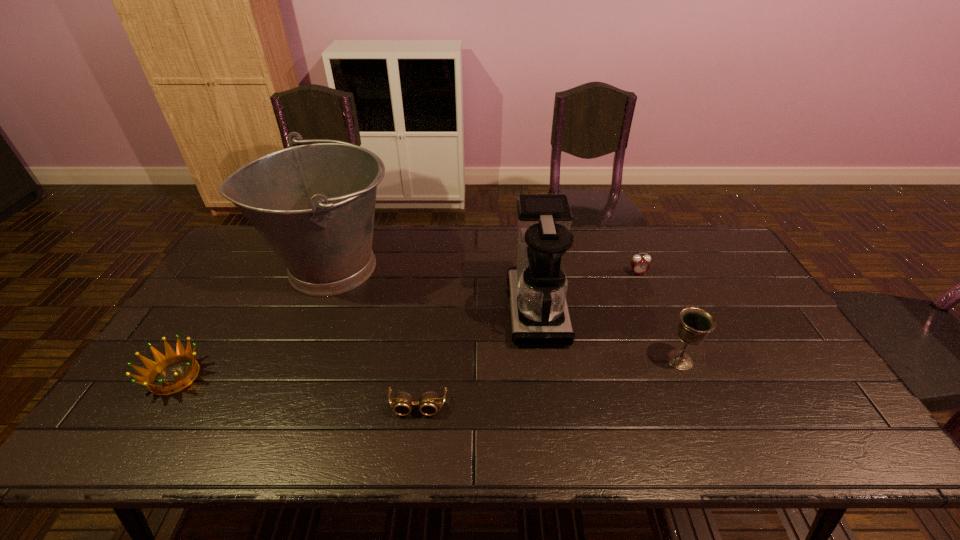
Identify the location of the tallest object. The width and height of the screenshot is (960, 540). (314, 204).

Where is `the second tallest object`? the second tallest object is located at coordinates (537, 287).

Identify the location of coffee maker. This screenshot has width=960, height=540. (537, 287).

Locate an element on the screen. the fourth shortest object is located at coordinates (695, 324).

Find the location of a particular element. The width and height of the screenshot is (960, 540). alarm clock is located at coordinates (640, 264).

I want to click on crown, so click(x=161, y=362).

The image size is (960, 540). Find the location of `goggles`. goggles is located at coordinates (428, 402).

Locate an element on the screen. The image size is (960, 540). the third object from left to right is located at coordinates (428, 402).

You are a GUI agent. You are given a task and a screenshot of the screen. Output one action in this format:
    pyautogui.click(x=<x>, y=<y>)
    Task: Click on the blank area located 0.240m on the front of the tallest object
    
    Given the screenshot: What is the action you would take?
    pyautogui.click(x=287, y=378)

The width and height of the screenshot is (960, 540). I want to click on free region located at the front of the third object from right to left where the controls are located, so click(x=382, y=310).